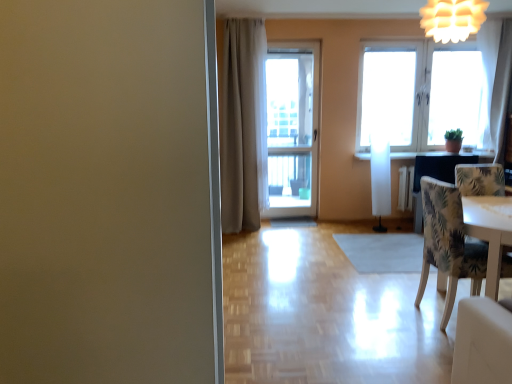
Find the location of a particular element. The width and height of the screenshot is (512, 384). patterned fabric chair at right is located at coordinates pos(448,243).

Measure the distance between white glass door at center and camera.

white glass door at center and camera are 5.36 meters apart.

What is the approximate width of beige fabric curtain at center, placed as the second curtain when sorted from right to left?

It is 44.01 centimeters.

The image size is (512, 384). What are the coordinates of `white sheer curtain at upper right, which ranks as the 2th curtain in left-to-right order` in the screenshot? It's located at (496, 79).

In the image, is patterned fabric chair at right on the left side or the right side of white paper lantern at upper right?

patterned fabric chair at right is positioned on white paper lantern at upper right's right side.

Looking at this image, from the image's perspective, is patterned fabric chair at right positioned above or below white paper lantern at upper right?

Based on their image positions, patterned fabric chair at right is located beneath white paper lantern at upper right.

Consider the image. Is white paper lantern at upper right located within patterned fabric chair at right?

No, patterned fabric chair at right does not contain white paper lantern at upper right.

Is white sheer curtain at upper right, which ranks as the 2th curtain in left-to-right order, not close to beige fabric curtain at center, placed as the second curtain when sorted from right to left?

Yes, white sheer curtain at upper right, which ranks as the 2th curtain in left-to-right order, is far from beige fabric curtain at center, placed as the second curtain when sorted from right to left.

Which is farther, (489, 42) or (237, 86)?

Positioned behind is point (237, 86).

Can you confirm if white sheer curtain at upper right, the 1th curtain in the right-to-left sequence, is smaller than beige fabric curtain at center, placed as the second curtain when sorted from right to left?

Indeed, white sheer curtain at upper right, the 1th curtain in the right-to-left sequence, has a smaller size compared to beige fabric curtain at center, placed as the second curtain when sorted from right to left.

In the scene shown: Considering the sizes of white sheer curtain at upper right, which ranks as the 2th curtain in left-to-right order, and beige fabric curtain at center, arranged as the first curtain when viewed from the left, in the image, is white sheer curtain at upper right, which ranks as the 2th curtain in left-to-right order, wider or thinner than beige fabric curtain at center, arranged as the first curtain when viewed from the left,?

Clearly, white sheer curtain at upper right, which ranks as the 2th curtain in left-to-right order, has less width compared to beige fabric curtain at center, arranged as the first curtain when viewed from the left.

Does patterned fabric chair at right appear on the right side of white sheer curtain at upper right, which ranks as the 2th curtain in left-to-right order?

No, patterned fabric chair at right is not to the right of white sheer curtain at upper right, which ranks as the 2th curtain in left-to-right order.

What's the angular difference between patterned fabric chair at right and white sheer curtain at upper right, which ranks as the 2th curtain in left-to-right order,'s facing directions?

patterned fabric chair at right and white sheer curtain at upper right, which ranks as the 2th curtain in left-to-right order, are facing 93.9 degrees away from each other.

In the image, there is a white sheer curtain at upper right, the 1th curtain in the right-to-left sequence. At what (x,y) coordinates should I click in order to perform the action: click on chair below it (from the image's perspective). Please return your answer as a coordinate pair (x, y). Looking at the image, I should click on (448, 243).

Is patterned fabric chair at right positioned far away from white sheer curtain at upper right, which ranks as the 2th curtain in left-to-right order?

Yes, patterned fabric chair at right and white sheer curtain at upper right, which ranks as the 2th curtain in left-to-right order, are quite far apart.

Does point (237, 61) come in front of point (379, 107)?

Yes, it is.

Considering the positions of objects beige fabric curtain at center, arranged as the first curtain when viewed from the left, and white glass window at upper right in the image provided, who is more to the right, beige fabric curtain at center, arranged as the first curtain when viewed from the left, or white glass window at upper right?

From the viewer's perspective, white glass window at upper right appears more on the right side.

Is beige fabric curtain at center, arranged as the first curtain when viewed from the left, bigger than white glass window at upper right?

Correct, beige fabric curtain at center, arranged as the first curtain when viewed from the left, is larger in size than white glass window at upper right.

Who is more distant, beige fabric curtain at center, arranged as the first curtain when viewed from the left, or white glass window at upper right?

white glass window at upper right is behind.

Is white glass door at center looking in the opposite direction of beige fabric curtain at center, arranged as the first curtain when viewed from the left?

No, beige fabric curtain at center, arranged as the first curtain when viewed from the left, is not at the back of white glass door at center.

Who is more distant, white glass door at center or beige fabric curtain at center, placed as the second curtain when sorted from right to left?

white glass door at center.

Who is bigger, white glass door at center or beige fabric curtain at center, arranged as the first curtain when viewed from the left?

With larger size is beige fabric curtain at center, arranged as the first curtain when viewed from the left.

From the image's perspective, who appears lower, white glass door at center or beige fabric curtain at center, arranged as the first curtain when viewed from the left?

beige fabric curtain at center, arranged as the first curtain when viewed from the left, is shown below in the image.

Is patterned fabric chair at right outside of white glass door at center?

patterned fabric chair at right lies outside white glass door at center's area.

Between point (423, 259) and point (297, 154), which one is positioned behind?

The point (297, 154) is farther.

Looking at their sizes, would you say patterned fabric chair at right is wider or thinner than white glass door at center?

In the image, patterned fabric chair at right appears to be wider than white glass door at center.

Between white glass door at center and white sheer curtain at upper right, the 1th curtain in the right-to-left sequence, which one appears on the left side from the viewer's perspective?

white glass door at center is more to the left.

Does white glass door at center contain white sheer curtain at upper right, which ranks as the 2th curtain in left-to-right order?

That's incorrect, white sheer curtain at upper right, which ranks as the 2th curtain in left-to-right order, is not inside white glass door at center.

From the image's perspective, which object appears higher, white glass door at center or white sheer curtain at upper right, the 1th curtain in the right-to-left sequence?

white sheer curtain at upper right, the 1th curtain in the right-to-left sequence, appears higher in the image.

Does point (278, 122) appear closer or farther from the camera than point (493, 40)?

Point (278, 122) is positioned farther from the camera compared to point (493, 40).

Locate an element on the screen. light fixture behind the patterned fabric chair at right is located at coordinates (452, 19).

Where is `curtain in front of the white sheer curtain at upper right, the 1th curtain in the right-to-left sequence`? The width and height of the screenshot is (512, 384). curtain in front of the white sheer curtain at upper right, the 1th curtain in the right-to-left sequence is located at coordinates (244, 126).

Based on their spatial positions, is white sheer curtain at upper right, the 1th curtain in the right-to-left sequence, or white glass window at upper right further from beige fabric curtain at center, placed as the second curtain when sorted from right to left?

Among the two, white sheer curtain at upper right, the 1th curtain in the right-to-left sequence, is located further to beige fabric curtain at center, placed as the second curtain when sorted from right to left.

Based on their spatial positions, is white glass door at center or beige fabric curtain at center, arranged as the first curtain when viewed from the left, further from white sheer curtain at upper right, the 1th curtain in the right-to-left sequence?

beige fabric curtain at center, arranged as the first curtain when viewed from the left, is positioned further to the anchor white sheer curtain at upper right, the 1th curtain in the right-to-left sequence.

Which object lies further to the anchor point patterned fabric chair at right, beige fabric curtain at center, placed as the second curtain when sorted from right to left, or white glass door at center?

white glass door at center is positioned further to the anchor patterned fabric chair at right.

When comparing their distances from white sheer curtain at upper right, which ranks as the 2th curtain in left-to-right order, does white paper lantern at upper right or beige fabric curtain at center, placed as the second curtain when sorted from right to left, seem closer?

white paper lantern at upper right.

Considering their positions, is white glass door at center positioned further to beige fabric curtain at center, arranged as the first curtain when viewed from the left, than white sheer curtain at upper right, which ranks as the 2th curtain in left-to-right order?

Based on the image, white sheer curtain at upper right, which ranks as the 2th curtain in left-to-right order, appears to be further to beige fabric curtain at center, arranged as the first curtain when viewed from the left.

Based on their spatial positions, is white paper lantern at upper right or white sheer curtain at upper right, the 1th curtain in the right-to-left sequence, closer to beige fabric curtain at center, arranged as the first curtain when viewed from the left?

white paper lantern at upper right is positioned closer to the anchor beige fabric curtain at center, arranged as the first curtain when viewed from the left.

Estimate the real-world distances between objects in this image. Which object is further from beige fabric curtain at center, placed as the second curtain when sorted from right to left, patterned fabric chair at right or white paper lantern at upper right?

Based on the image, patterned fabric chair at right appears to be further to beige fabric curtain at center, placed as the second curtain when sorted from right to left.

From the image, which object appears to be nearer to patterned fabric chair at right, white paper lantern at upper right or white glass door at center?

Based on the image, white paper lantern at upper right appears to be nearer to patterned fabric chair at right.

Image resolution: width=512 pixels, height=384 pixels. I want to click on light fixture between patterned fabric chair at right and white sheer curtain at upper right, which ranks as the 2th curtain in left-to-right order, from front to back, so click(452, 19).

What are the coordinates of `door located between beige fabric curtain at center, arranged as the first curtain when viewed from the left, and white glass window at upper right in the left-right direction` in the screenshot? It's located at (292, 127).

Locate an element on the screen. light fixture positioned between patterned fabric chair at right and white glass door at center from near to far is located at coordinates (452, 19).

Locate an element on the screen. This screenshot has height=384, width=512. window positioned between white paper lantern at upper right and white glass door at center from near to far is located at coordinates (419, 93).